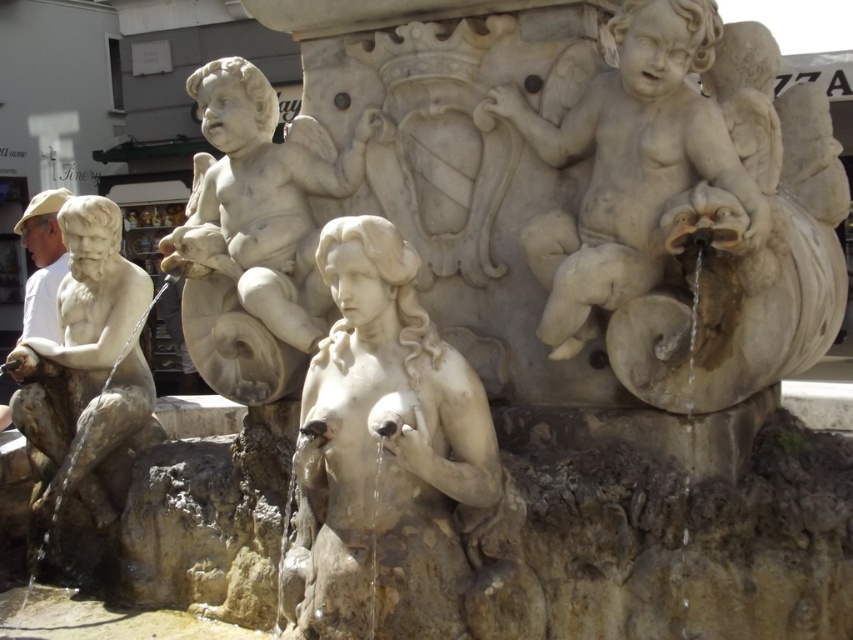
You are an architect designing a new plaza and want to ensure the white marble cherub at upper center and the matte stone man at left are placed so that the cherub doesn not block the view of the man. Given their heights, is this possible?

The white marble cherub at upper center is not as tall as the matte stone man at left, so placing the cherub in front of the man could allow the taller man to be seen above the cherub, thus preventing the cherub from blocking the view.

You are standing in front of the marble fountain sculpture and want to know which of the two points, point (451, 493) or point (728, 141), is closer to you. Which one is closer?

Point (451, 493) is in front of point (728, 141), so it is closer to you.